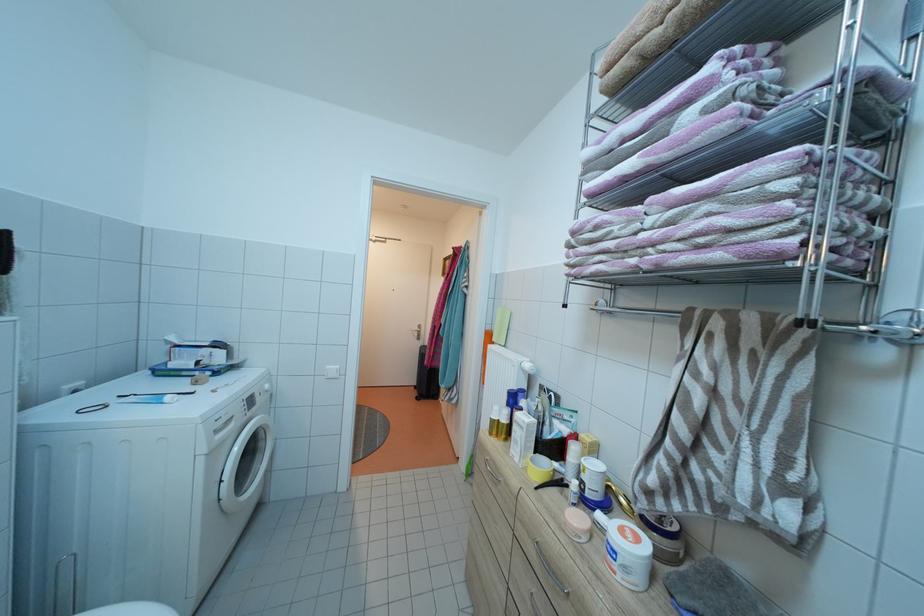
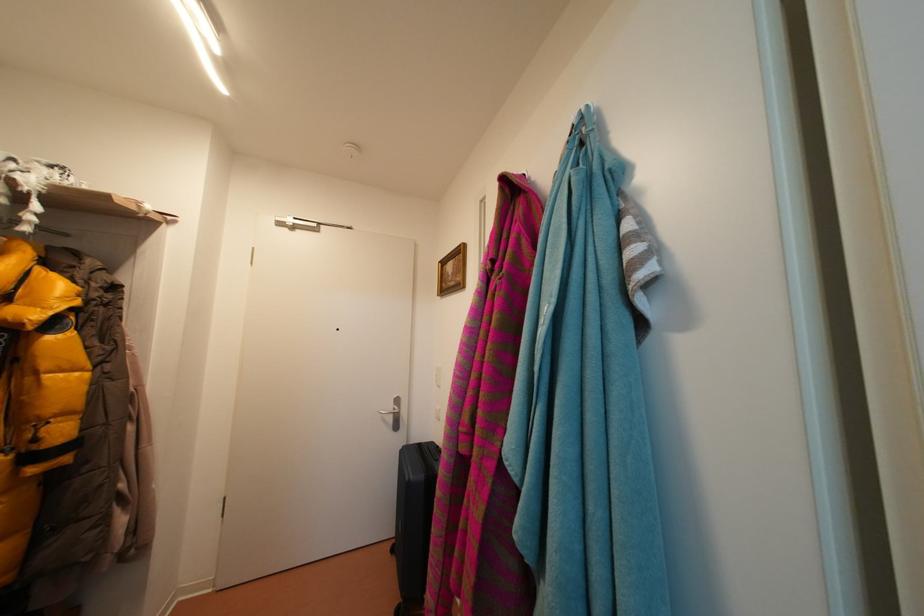
Question: What movement of the cameraman would produce the second image?

Choices:
 (A) Left
 (B) Right
 (C) Forward
 (D) Backward

Answer: (C)